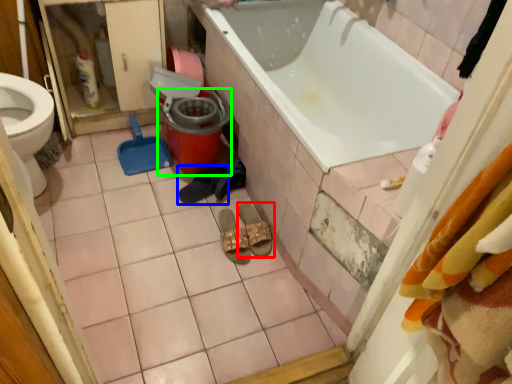
Question: Estimate the real-world distances between objects in this image. Which object is closer to footwear (highlighted by a red box), footwear (highlighted by a blue box) or potty (highlighted by a green box)?

Choices:
 (A) footwear
 (B) potty

Answer: (A)